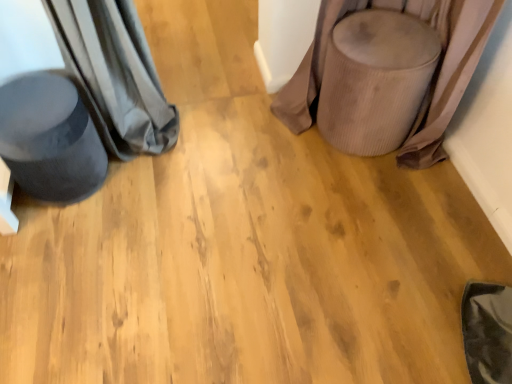
At what (x,y) coordinates should I click in order to perform the action: click on spots to the right of velvet dark grey swivel chair at left, which is the second swivel chair in right-to-left order. Please return your answer as a coordinate pair (x, y). Looking at the image, I should click on (145, 187).